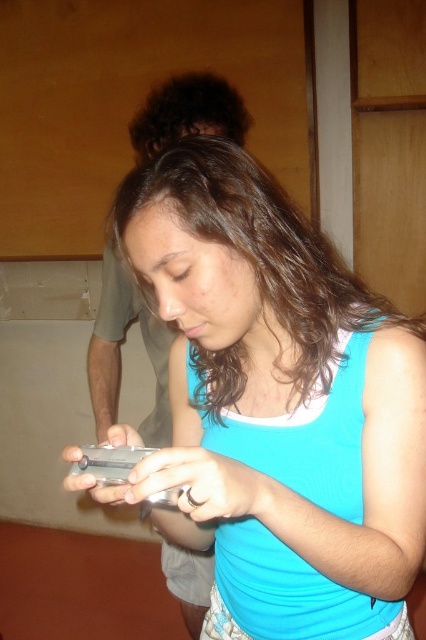
You are a security camera in the room. You need to report the position of the matte silver phone at center. What are its coordinates?

The coordinates of the matte silver phone at center are at point (276,404).